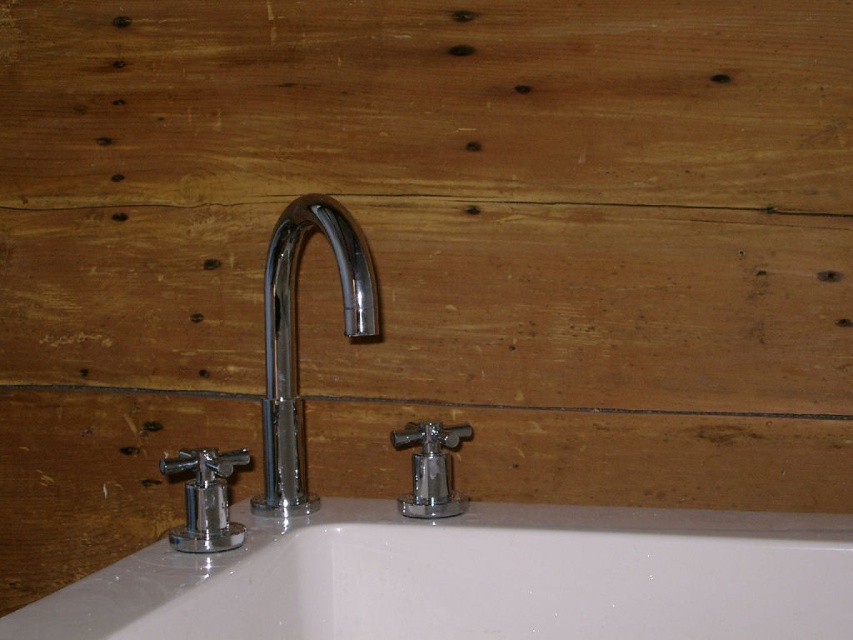
You are standing in front of the bathroom sink area shown in the image. There is a point marked at coordinates point (474,579). Based on the scene description, what object does this point correspond to?

The point (474,579) corresponds to the white glossy bath at center.